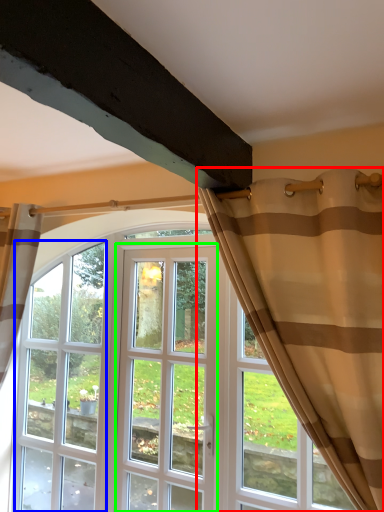
Question: Based on their relative distances, which object is nearer to curtain (highlighted by a red box)? Choose from window (highlighted by a blue box) and screen door (highlighted by a green box).

Choices:
 (A) window
 (B) screen door

Answer: (B)